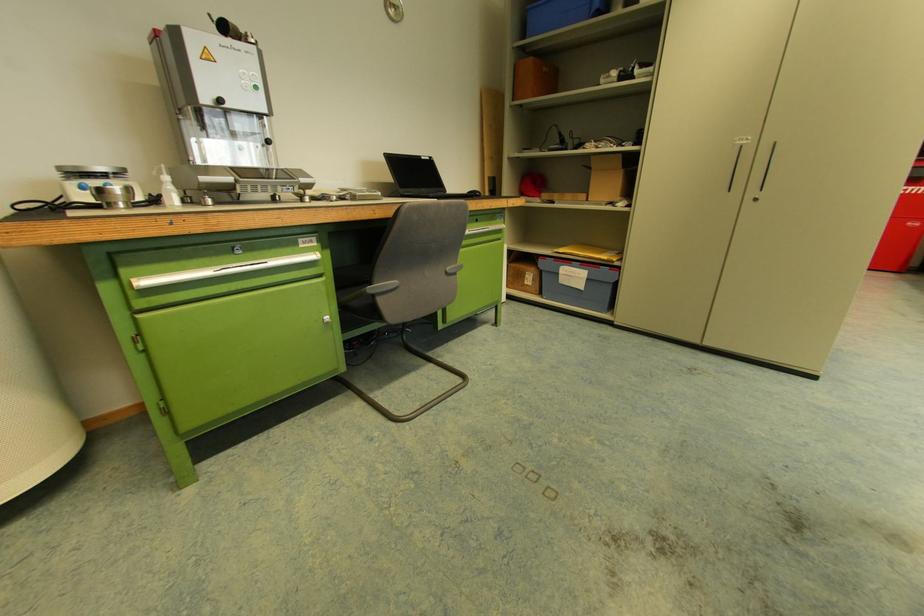
What do you see at coordinates (254, 87) in the screenshot? I see `a green round button` at bounding box center [254, 87].